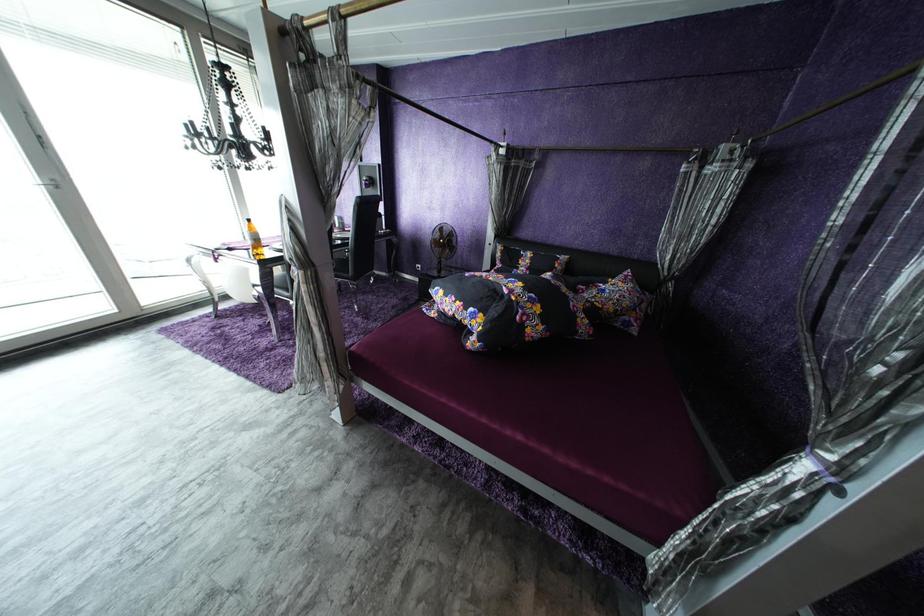
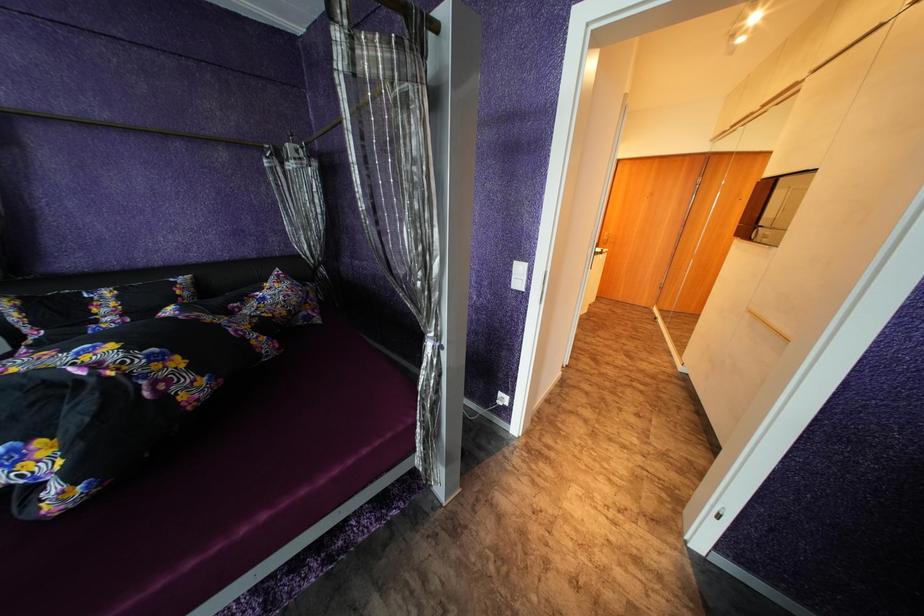
First-person continuous shooting, in which direction is the camera rotating?

The camera's rotation is toward right-down.